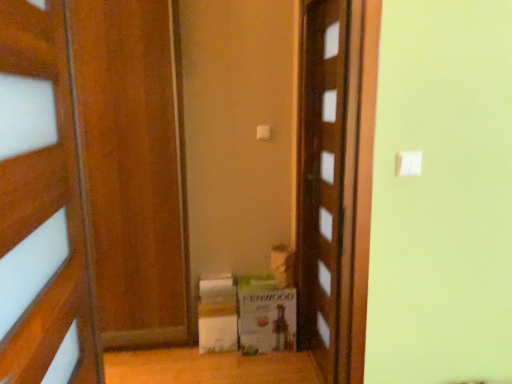
What do you see at coordinates (217, 326) in the screenshot?
I see `white cardboard box at lower center, the first cardboard box viewed from the left` at bounding box center [217, 326].

Find the location of a particular element. This screenshot has width=512, height=384. green cardboard box at center, which ranks as the 2th cardboard box in left-to-right order is located at coordinates (265, 316).

Would you say wooden door at center, the first door positioned from the back, is inside or outside wooden door at left, placed as the 1th door when sorted from left to right?

The correct answer is: outside.

Which of these two, wooden door at center, the first door positioned from the back, or wooden door at left, which is the 2th door in back-to-front order, stands shorter?

wooden door at left, which is the 2th door in back-to-front order.

Based on the photo, in terms of width, does wooden door at center, the first door when ordered from right to left, look wider or thinner when compared to wooden door at left, which ranks as the first door in front-to-back order?

In the image, wooden door at center, the first door when ordered from right to left, appears to be more narrow than wooden door at left, which ranks as the first door in front-to-back order.

From a real-world perspective, is wooden door at center, which ranks as the second door in left-to-right order, below wooden door at left, placed as the 1th door when sorted from left to right?

A: Yes, from a real-world perspective, wooden door at center, which ranks as the second door in left-to-right order, is under wooden door at left, placed as the 1th door when sorted from left to right.

Locate an element on the screen. The height and width of the screenshot is (384, 512). the 2nd door above the white cardboard box at lower center, the first cardboard box viewed from the left (from the image's perspective) is located at coordinates (322, 177).

Is white cardboard box at lower center, positioned as the 2th cardboard box in right-to-left order, surrounded by wooden door at center, acting as the 2th door starting from the front?

No, white cardboard box at lower center, positioned as the 2th cardboard box in right-to-left order, is not inside wooden door at center, acting as the 2th door starting from the front.

From the image's perspective, would you say wooden door at center, the first door when ordered from right to left, is shown under white cardboard box at lower center, positioned as the 2th cardboard box in right-to-left order?

No, from the image's perspective, wooden door at center, the first door when ordered from right to left, is not beneath white cardboard box at lower center, positioned as the 2th cardboard box in right-to-left order.

From their relative heights in the image, would you say wooden door at center, the first door when ordered from right to left, is taller or shorter than white cardboard box at lower center, the first cardboard box viewed from the left?

wooden door at center, the first door when ordered from right to left, is taller than white cardboard box at lower center, the first cardboard box viewed from the left.

How much distance is there between wooden door at center, which ranks as the second door in left-to-right order, and green cardboard box at center, which ranks as the 2th cardboard box in left-to-right order?

A distance of 14.73 inches exists between wooden door at center, which ranks as the second door in left-to-right order, and green cardboard box at center, which ranks as the 2th cardboard box in left-to-right order.

Is wooden door at center, the first door when ordered from right to left, placed right next to green cardboard box at center, placed as the 1th cardboard box when sorted from right to left?

There is a gap between wooden door at center, the first door when ordered from right to left, and green cardboard box at center, placed as the 1th cardboard box when sorted from right to left.

Is wooden door at center, acting as the 2th door starting from the front, oriented towards green cardboard box at center, placed as the 1th cardboard box when sorted from right to left?

Yes, wooden door at center, acting as the 2th door starting from the front, is oriented towards green cardboard box at center, placed as the 1th cardboard box when sorted from right to left.

Does wooden door at center, acting as the 2th door starting from the front, have a smaller size compared to green cardboard box at center, placed as the 1th cardboard box when sorted from right to left?

Incorrect, wooden door at center, acting as the 2th door starting from the front, is not smaller in size than green cardboard box at center, placed as the 1th cardboard box when sorted from right to left.

How many degrees apart are the facing directions of green cardboard box at center, placed as the 1th cardboard box when sorted from right to left, and white cardboard box at lower center, the first cardboard box viewed from the left?

They differ by 0.000209 degrees in their facing directions.

From the image's perspective, is green cardboard box at center, which ranks as the 2th cardboard box in left-to-right order, located above or below white cardboard box at lower center, the first cardboard box viewed from the left?

green cardboard box at center, which ranks as the 2th cardboard box in left-to-right order, is above white cardboard box at lower center, the first cardboard box viewed from the left.

Locate an element on the screen. This screenshot has height=384, width=512. cardboard box that is in front of the green cardboard box at center, placed as the 1th cardboard box when sorted from right to left is located at coordinates 217,326.

Between green cardboard box at center, placed as the 1th cardboard box when sorted from right to left, and white cardboard box at lower center, positioned as the 2th cardboard box in right-to-left order, which one has larger size?

green cardboard box at center, placed as the 1th cardboard box when sorted from right to left, is bigger.

Between white cardboard box at lower center, the first cardboard box viewed from the left, and green cardboard box at center, which ranks as the 2th cardboard box in left-to-right order, which one is positioned in front?

Positioned in front is white cardboard box at lower center, the first cardboard box viewed from the left.

Considering the points (198, 326) and (257, 291), which point is in front, point (198, 326) or point (257, 291)?

The point (257, 291) is closer to the camera.

Which of these two, white cardboard box at lower center, the first cardboard box viewed from the left, or green cardboard box at center, which ranks as the 2th cardboard box in left-to-right order, is smaller?

white cardboard box at lower center, the first cardboard box viewed from the left.

This screenshot has width=512, height=384. What are the coordinates of `cardboard box lying on the left of green cardboard box at center, placed as the 1th cardboard box when sorted from right to left` in the screenshot? It's located at pyautogui.click(x=217, y=326).

From the image's perspective, is wooden door at left, which is the second door in right-to-left order, located above or below green cardboard box at center, which ranks as the 2th cardboard box in left-to-right order?

wooden door at left, which is the second door in right-to-left order, is situated higher than green cardboard box at center, which ranks as the 2th cardboard box in left-to-right order, in the image.

Looking at this image, is wooden door at left, placed as the 1th door when sorted from left to right, wider than green cardboard box at center, placed as the 1th cardboard box when sorted from right to left?

Incorrect, the width of wooden door at left, placed as the 1th door when sorted from left to right, does not surpass that of green cardboard box at center, placed as the 1th cardboard box when sorted from right to left.

Is wooden door at left, which is the 2th door in back-to-front order, looking in the opposite direction of green cardboard box at center, placed as the 1th cardboard box when sorted from right to left?

No, wooden door at left, which is the 2th door in back-to-front order, is not facing away from green cardboard box at center, placed as the 1th cardboard box when sorted from right to left.

Considering the relative sizes of wooden door at left, which is the second door in right-to-left order, and green cardboard box at center, which ranks as the 2th cardboard box in left-to-right order, in the image provided, is wooden door at left, which is the second door in right-to-left order, shorter than green cardboard box at center, which ranks as the 2th cardboard box in left-to-right order,?

Incorrect, the height of wooden door at left, which is the second door in right-to-left order, does not fall short of that of green cardboard box at center, which ranks as the 2th cardboard box in left-to-right order.

Which object is positioned more to the right, wooden door at left, which ranks as the first door in front-to-back order, or wooden door at center, the first door positioned from the back?

wooden door at center, the first door positioned from the back.

Is point (45, 246) less distant than point (311, 147)?

Yes, point (45, 246) is closer to viewer.

Is wooden door at left, which is the second door in right-to-left order, smaller than wooden door at center, the first door positioned from the back?

Incorrect, wooden door at left, which is the second door in right-to-left order, is not smaller in size than wooden door at center, the first door positioned from the back.

In order to click on door that appears behind the wooden door at left, which is the 2th door in back-to-front order in this screenshot , I will do `click(322, 177)`.

Find the location of a particular element. Image resolution: width=512 pixels, height=384 pixels. the 2nd door positioned above the white cardboard box at lower center, the first cardboard box viewed from the left (from the image's perspective) is located at coordinates (322, 177).

Based on their spatial positions, is white cardboard box at lower center, positioned as the 2th cardboard box in right-to-left order, or green cardboard box at center, placed as the 1th cardboard box when sorted from right to left, closer to wooden door at left, which is the 2th door in back-to-front order?

Based on the image, green cardboard box at center, placed as the 1th cardboard box when sorted from right to left, appears to be nearer to wooden door at left, which is the 2th door in back-to-front order.

Considering their positions, is wooden door at center, acting as the 2th door starting from the front, positioned further to green cardboard box at center, placed as the 1th cardboard box when sorted from right to left, than white cardboard box at lower center, the first cardboard box viewed from the left?

wooden door at center, acting as the 2th door starting from the front, is positioned further to the anchor green cardboard box at center, placed as the 1th cardboard box when sorted from right to left.

When comparing their distances from wooden door at center, the first door positioned from the back, does white cardboard box at lower center, the first cardboard box viewed from the left, or green cardboard box at center, which ranks as the 2th cardboard box in left-to-right order, seem closer?

Based on the image, green cardboard box at center, which ranks as the 2th cardboard box in left-to-right order, appears to be nearer to wooden door at center, the first door positioned from the back.

Based on their spatial positions, is white cardboard box at lower center, the first cardboard box viewed from the left, or wooden door at left, which is the 2th door in back-to-front order, further from green cardboard box at center, placed as the 1th cardboard box when sorted from right to left?

Based on the image, wooden door at left, which is the 2th door in back-to-front order, appears to be further to green cardboard box at center, placed as the 1th cardboard box when sorted from right to left.

Based on their spatial positions, is wooden door at left, which is the 2th door in back-to-front order, or wooden door at center, the first door positioned from the back, further from green cardboard box at center, which ranks as the 2th cardboard box in left-to-right order?

wooden door at left, which is the 2th door in back-to-front order, is positioned further to the anchor green cardboard box at center, which ranks as the 2th cardboard box in left-to-right order.

Based on their spatial positions, is wooden door at center, the first door positioned from the back, or white cardboard box at lower center, positioned as the 2th cardboard box in right-to-left order, closer to wooden door at left, which is the 2th door in back-to-front order?

Among the two, wooden door at center, the first door positioned from the back, is located nearer to wooden door at left, which is the 2th door in back-to-front order.

From the image, which object appears to be nearer to wooden door at center, the first door positioned from the back, green cardboard box at center, placed as the 1th cardboard box when sorted from right to left, or white cardboard box at lower center, the first cardboard box viewed from the left?

green cardboard box at center, placed as the 1th cardboard box when sorted from right to left, lies closer to wooden door at center, the first door positioned from the back, than the other object.

Looking at the image, which one is located closer to wooden door at left, which ranks as the first door in front-to-back order, white cardboard box at lower center, the first cardboard box viewed from the left, or wooden door at center, acting as the 2th door starting from the front?

wooden door at center, acting as the 2th door starting from the front, lies closer to wooden door at left, which ranks as the first door in front-to-back order, than the other object.

Find the location of a particular element. cardboard box between wooden door at left, which is the second door in right-to-left order, and green cardboard box at center, placed as the 1th cardboard box when sorted from right to left, from front to back is located at coordinates (217, 326).

Image resolution: width=512 pixels, height=384 pixels. Identify the location of door between wooden door at left, which is the 2th door in back-to-front order, and white cardboard box at lower center, the first cardboard box viewed from the left, from front to back. (322, 177).

The height and width of the screenshot is (384, 512). Find the location of `door between wooden door at left, which is the second door in right-to-left order, and green cardboard box at center, which ranks as the 2th cardboard box in left-to-right order, in the front-back direction`. door between wooden door at left, which is the second door in right-to-left order, and green cardboard box at center, which ranks as the 2th cardboard box in left-to-right order, in the front-back direction is located at coordinates (322, 177).

The width and height of the screenshot is (512, 384). Identify the location of cardboard box between wooden door at center, acting as the 2th door starting from the front, and white cardboard box at lower center, positioned as the 2th cardboard box in right-to-left order, in the up-down direction. [x=265, y=316].